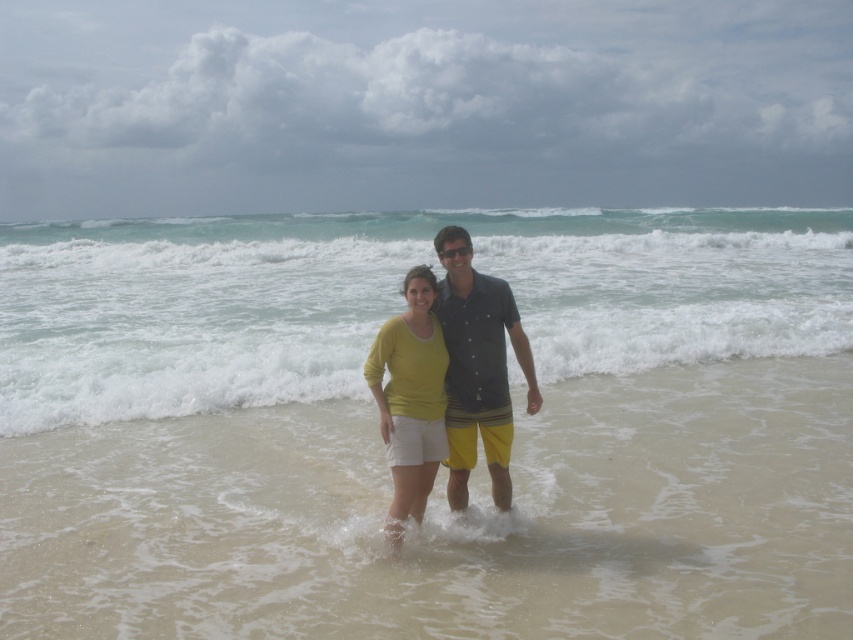
Question: From the image, what is the correct spatial relationship of dark blue button-up shirt at center in relation to matte yellow sweater at center?

Choices:
 (A) right
 (B) left

Answer: (A)

Question: Is smooth sand at center further to camera compared to matte yellow sweater at center?

Choices:
 (A) no
 (B) yes

Answer: (A)

Question: Which of the following is the farthest from the observer?

Choices:
 (A) dark blue button-up shirt at center
 (B) matte yellow sweater at center
 (C) clear blue water at center

Answer: (C)

Question: Is dark blue button-up shirt at center to the left of matte yellow sweater at center from the viewer's perspective?

Choices:
 (A) no
 (B) yes

Answer: (A)

Question: Which point is closer to the camera?

Choices:
 (A) (424, 304)
 (B) (695, 228)

Answer: (A)

Question: Which of the following is the farthest from the observer?

Choices:
 (A) (418, 285)
 (B) (781, 292)
 (C) (189, 419)

Answer: (B)